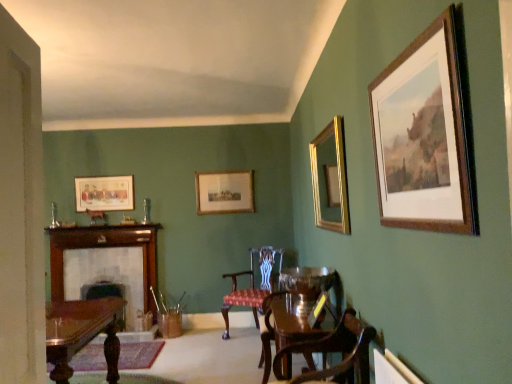
Question: Looking at their shapes, would you say velvet upholstered chair at center, positioned as the 3th chair in front-to-back order, is wider or thinner than wooden picture frame at center, the 2th picture frame from the left?

Choices:
 (A) thin
 (B) wide

Answer: (B)

Question: Based on their positions, is velvet upholstered chair at center, which is the 1th chair in back-to-front order, located to the left or right of wooden picture frame at center, which is counted as the fourth picture frame, starting from the front?

Choices:
 (A) left
 (B) right

Answer: (B)

Question: Which object is the closest to the wooden polished chair at center, which is the 2th chair in back-to-front order?

Choices:
 (A) wooden polished chair at lower right, the 3th chair in the back-to-front sequence
 (B) matte wooden picture frame at upper left, the first picture frame from the left
 (C) wooden picture frame at center, acting as the 1th picture frame starting from the back
 (D) wooden fireplace at left
 (E) velvet upholstered chair at center, positioned as the 3th chair in front-to-back order

Answer: (A)

Question: Which object is positioned closest to the wooden fireplace at left?

Choices:
 (A) mahogany polished table at left
 (B) gold/gilded mirror at upper right, the second picture frame in the right-to-left sequence
 (C) wooden picture frame at upper right, marked as the first picture frame in a front-to-back arrangement
 (D) wooden picture frame at center, acting as the 1th picture frame starting from the back
 (E) velvet upholstered chair at center, positioned as the 3th chair in front-to-back order

Answer: (D)